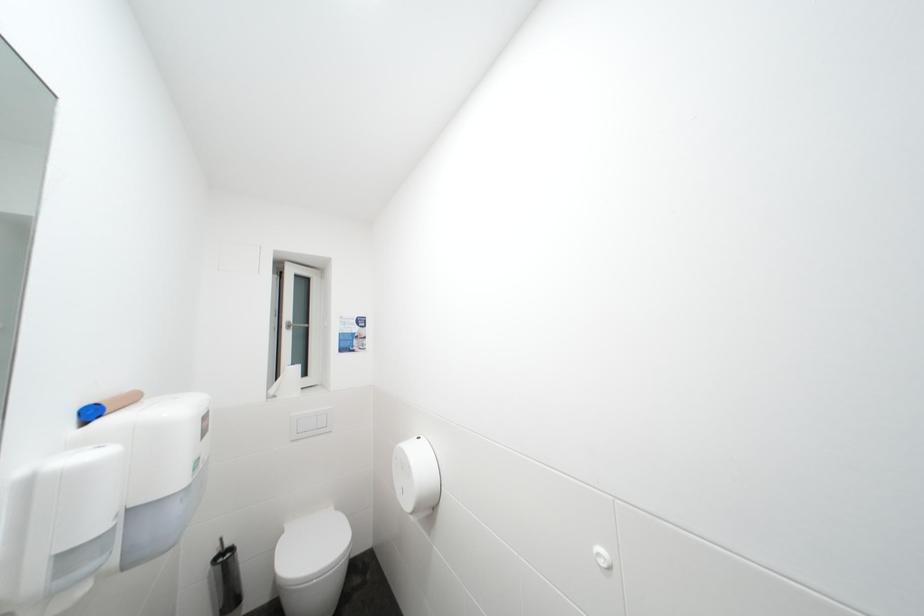
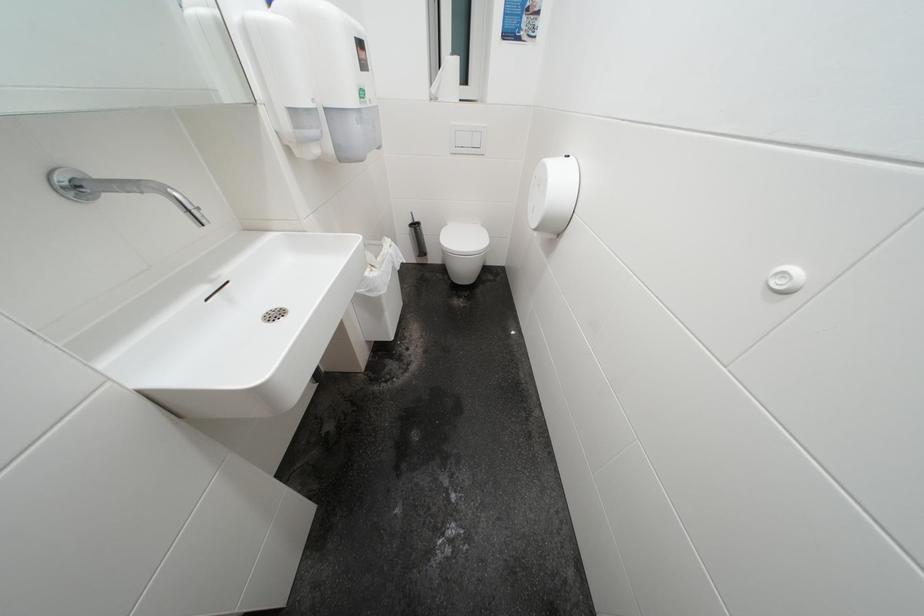
The images are taken continuously from a first-person perspective. In which direction is your viewpoint rotating?

The camera rotated toward left-down.